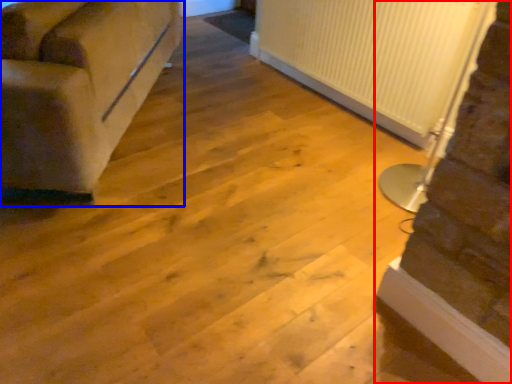
Question: Which point is further to the camera, stairwell (highlighted by a red box) or studio couch (highlighted by a blue box)?

Choices:
 (A) stairwell
 (B) studio couch

Answer: (B)